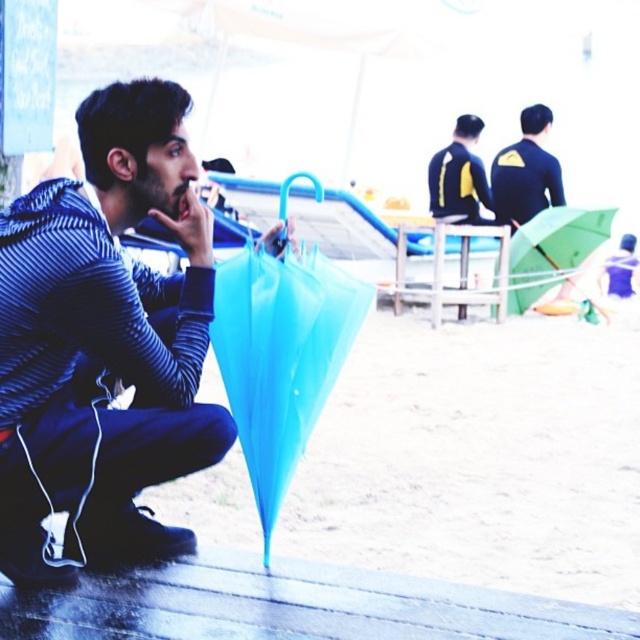
Is point (296, 273) in front of point (518, 148)?

Yes, it is in front of point (518, 148).

Which is above, translucent plastic umbrella at lower center or matte black wetsuit at upper right?

Positioned higher is matte black wetsuit at upper right.

What do you see at coordinates (282, 356) in the screenshot?
I see `translucent plastic umbrella at lower center` at bounding box center [282, 356].

Where is `translucent plastic umbrella at lower center`? translucent plastic umbrella at lower center is located at coordinates (282, 356).

Is the position of striped hoodie at center less distant than that of green matte umbrella at upper right?

Yes, it is.

Can you confirm if striped hoodie at center is taller than green matte umbrella at upper right?

Yes, striped hoodie at center is taller than green matte umbrella at upper right.

Identify the location of striped hoodie at center. The height and width of the screenshot is (640, 640). (104, 337).

Can you confirm if green matte umbrella at upper right is shorter than matte black wetsuit at upper right?

Correct, green matte umbrella at upper right is not as tall as matte black wetsuit at upper right.

Does green matte umbrella at upper right come in front of matte black wetsuit at upper right?

Yes, green matte umbrella at upper right is in front of matte black wetsuit at upper right.

What are the coordinates of `green matte umbrella at upper right` in the screenshot? It's located at (552, 250).